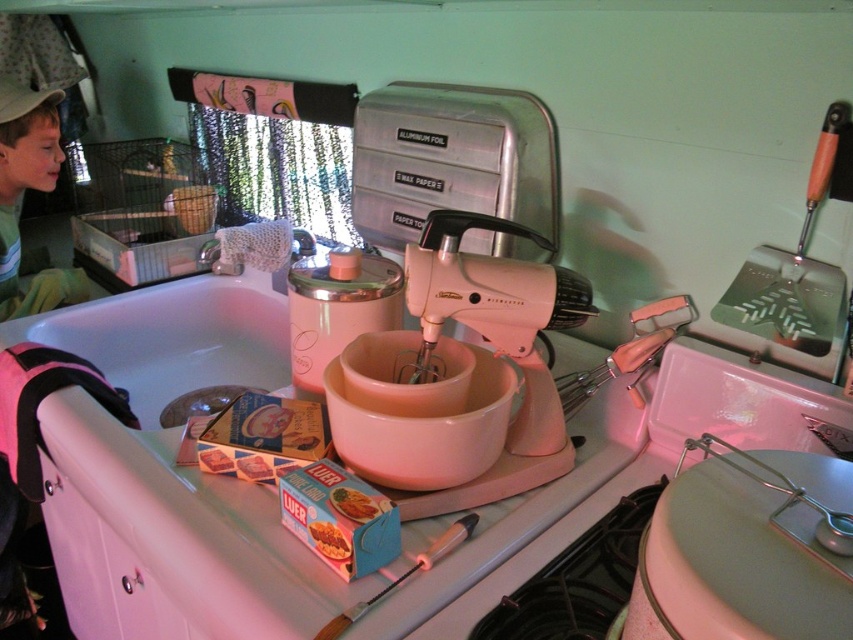
You are a chef standing in front of the kitchen scene described. You need to reach two points in the image to retrieve ingredients. The first point is at coordinate point (378, 444) and the second is at point (15, 182). Which point will you reach first if you move directly towards them?

You will reach point (378, 444) first because it is closer to you than point (15, 182) according to the spatial description provided.

You are organizing a kitchen pantry and need to place the green cotton shirt at upper left and the matte cardboard box of luer at center into a shelf. Which object requires a wider space to fit properly?

The green cotton shirt at upper left requires a wider space because its width is larger than the matte cardboard box of luer at center.

You are organizing items in the retro kitchen and need to place the green cotton shirt at upper left. According to the layout, where exactly should you position it?

The green cotton shirt at upper left should be positioned at point (x=22, y=196) as specified in the description.